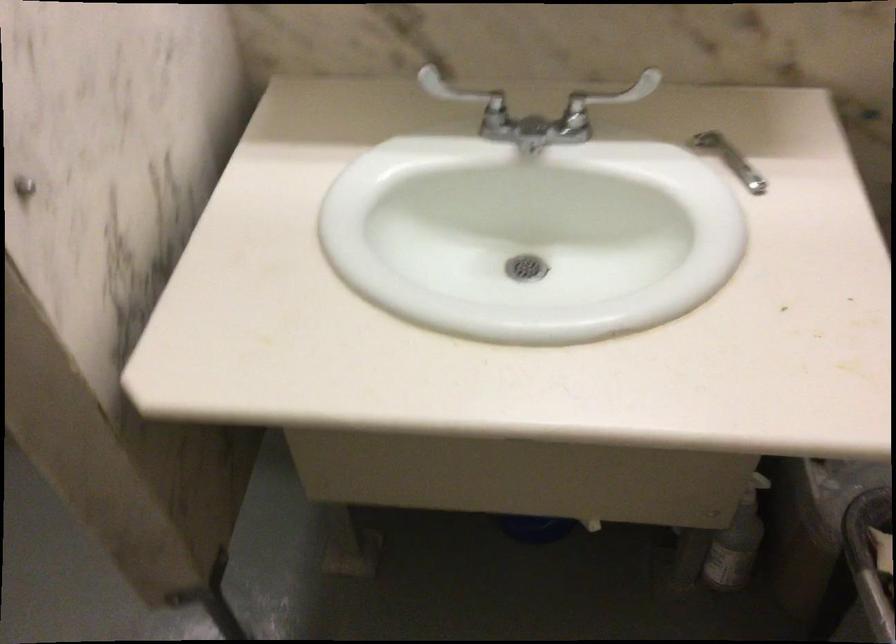
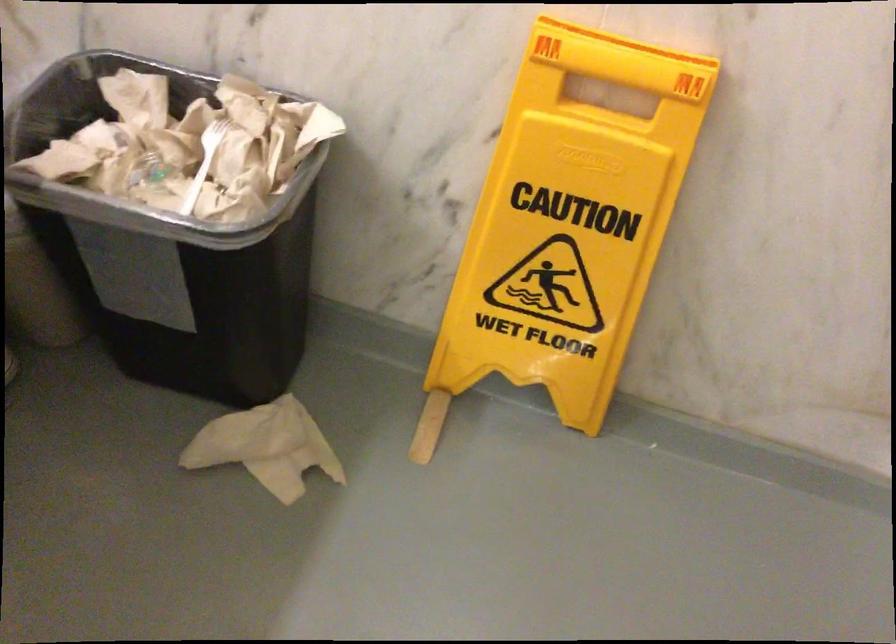
Based on the continuous images, in which direction is the camera rotating?

The camera rotated toward right-down.